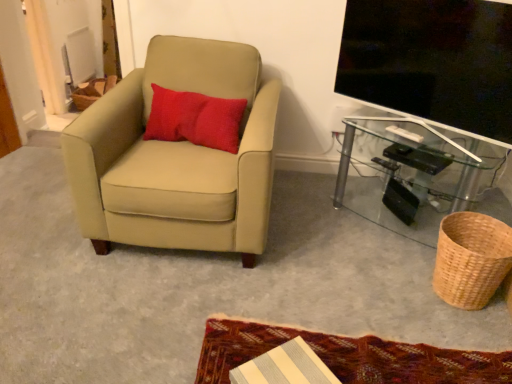
Question: Can you see woven natural basket at lower right touching suede beige armchair at left?

Choices:
 (A) yes
 (B) no

Answer: (B)

Question: Is woven natural basket at lower right not close to suede beige armchair at left?

Choices:
 (A) no
 (B) yes

Answer: (B)

Question: Is woven natural basket at lower right oriented towards suede beige armchair at left?

Choices:
 (A) yes
 (B) no

Answer: (A)

Question: Can you confirm if woven natural basket at lower right is bigger than suede beige armchair at left?

Choices:
 (A) yes
 (B) no

Answer: (B)

Question: Is woven natural basket at lower right further to camera compared to suede beige armchair at left?

Choices:
 (A) no
 (B) yes

Answer: (B)

Question: Is red textured pillow at upper left wider or thinner than flat screen tv at upper right?

Choices:
 (A) thin
 (B) wide

Answer: (B)

Question: From their relative heights in the image, would you say red textured pillow at upper left is taller or shorter than flat screen tv at upper right?

Choices:
 (A) short
 (B) tall

Answer: (A)

Question: Is point (230, 127) positioned closer to the camera than point (376, 99)?

Choices:
 (A) closer
 (B) farther

Answer: (A)

Question: From the image's perspective, is red textured pillow at upper left positioned above or below flat screen tv at upper right?

Choices:
 (A) above
 (B) below

Answer: (B)

Question: From the image's perspective, is transparent glass table at lower right positioned above or below textured woolen mat at lower center?

Choices:
 (A) below
 (B) above

Answer: (B)

Question: Is transparent glass table at lower right wider or thinner than textured woolen mat at lower center?

Choices:
 (A) wide
 (B) thin

Answer: (B)

Question: Is transparent glass table at lower right situated inside textured woolen mat at lower center or outside?

Choices:
 (A) outside
 (B) inside

Answer: (A)

Question: Is transparent glass table at lower right to the left or to the right of textured woolen mat at lower center in the image?

Choices:
 (A) right
 (B) left

Answer: (A)

Question: From the image's perspective, is flat screen tv at upper right positioned above or below textured woolen mat at lower center?

Choices:
 (A) below
 (B) above

Answer: (B)

Question: From their relative heights in the image, would you say flat screen tv at upper right is taller or shorter than textured woolen mat at lower center?

Choices:
 (A) tall
 (B) short

Answer: (A)